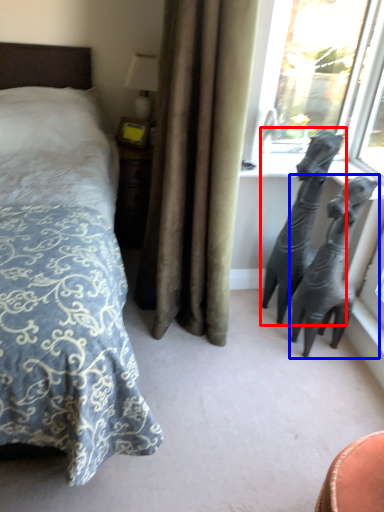
Question: Which object appears farthest to the camera in this image, animal (highlighted by a red box) or bronze sculpture (highlighted by a blue box)?

Choices:
 (A) animal
 (B) bronze sculpture

Answer: (A)